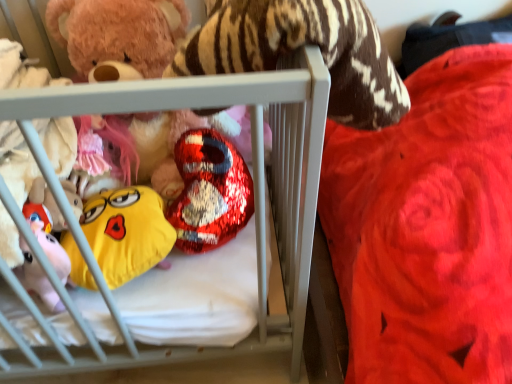
The image size is (512, 384). Identify the location of spots to the right of yellow plush emoji at center, marked as the first toy in a bottom-to-top arrangement. (217, 286).